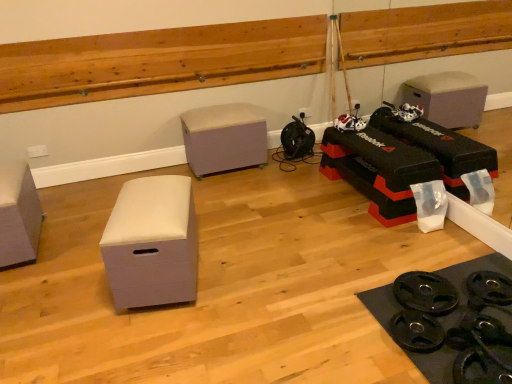
Image resolution: width=512 pixels, height=384 pixels. Describe the element at coordinates (224, 138) in the screenshot. I see `beige fabric ottoman at center, acting as the third furniture starting from the left` at that location.

Image resolution: width=512 pixels, height=384 pixels. What do you see at coordinates (152, 243) in the screenshot? I see `white matte storage box at center-left, which is counted as the 2th furniture, starting from the right` at bounding box center [152, 243].

At what (x,y) coordinates should I click in order to perform the action: click on beige fabric ottoman at center, the first furniture in the back-to-front sequence. Please return your answer as a coordinate pair (x, y). This screenshot has height=384, width=512. Looking at the image, I should click on [x=224, y=138].

Is white matte storage box at center-left, the 3th furniture in the back-to-front sequence, looking in the opposite direction of matte gray storage box at left, which is counted as the 2th furniture, starting from the back?

No, white matte storage box at center-left, the 3th furniture in the back-to-front sequence, is not facing the opposite direction of matte gray storage box at left, which is counted as the 2th furniture, starting from the back.

Looking at this image, is the surface of white matte storage box at center-left, placed as the second furniture when sorted from left to right, in direct contact with matte gray storage box at left, placed as the third furniture when sorted from right to left?

white matte storage box at center-left, placed as the second furniture when sorted from left to right, and matte gray storage box at left, placed as the third furniture when sorted from right to left, are clearly separated.

Does point (183, 259) come closer to viewer compared to point (28, 204)?

Yes.

Considering the positions of objects white matte storage box at center-left, placed as the second furniture when sorted from left to right, and matte gray storage box at left, which is counted as the 2th furniture, starting from the back, in the image provided, who is behind, white matte storage box at center-left, placed as the second furniture when sorted from left to right, or matte gray storage box at left, which is counted as the 2th furniture, starting from the back,?

matte gray storage box at left, which is counted as the 2th furniture, starting from the back, is behind.

Is beige fabric ottoman at center, acting as the third furniture starting from the left, directly adjacent to wooden ledge at upper center?

No.

Does beige fabric ottoman at center, the 3th furniture positioned from the front, appear on the right side of wooden ledge at upper center?

Correct, you'll find beige fabric ottoman at center, the 3th furniture positioned from the front, to the right of wooden ledge at upper center.

Is wooden ledge at upper center inside beige fabric ottoman at center, the first furniture in the back-to-front sequence?

No, wooden ledge at upper center is not inside beige fabric ottoman at center, the first furniture in the back-to-front sequence.

From the image's perspective, is wooden ledge at upper center under white matte storage box at center-left, which is counted as the 2th furniture, starting from the right?

No, from the image's perspective, wooden ledge at upper center is not beneath white matte storage box at center-left, which is counted as the 2th furniture, starting from the right.

Which object is closer to the camera taking this photo, wooden ledge at upper center or white matte storage box at center-left, placed as the second furniture when sorted from left to right?

white matte storage box at center-left, placed as the second furniture when sorted from left to right, is more forward.

Is wooden ledge at upper center aimed at white matte storage box at center-left, placed as the second furniture when sorted from left to right?

No, wooden ledge at upper center is not aimed at white matte storage box at center-left, placed as the second furniture when sorted from left to right.

How many degrees apart are the facing directions of wooden ledge at upper center and white matte storage box at center-left, which is counted as the 2th furniture, starting from the right?

The facing directions of wooden ledge at upper center and white matte storage box at center-left, which is counted as the 2th furniture, starting from the right, are 103 degrees apart.

Is wooden ledge at upper center oriented towards beige fabric ottoman at center, the 3th furniture positioned from the front?

No, wooden ledge at upper center is not facing towards beige fabric ottoman at center, the 3th furniture positioned from the front.

Looking at this image, is wooden ledge at upper center beside beige fabric ottoman at center, which is counted as the 1th furniture, starting from the right?

wooden ledge at upper center and beige fabric ottoman at center, which is counted as the 1th furniture, starting from the right, are clearly separated.

Does wooden ledge at upper center have a lesser height compared to beige fabric ottoman at center, which is counted as the 1th furniture, starting from the right?

Indeed, wooden ledge at upper center has a lesser height compared to beige fabric ottoman at center, which is counted as the 1th furniture, starting from the right.

Looking at this image, can you confirm if wooden ledge at upper center is positioned to the right of beige fabric ottoman at center, the first furniture in the back-to-front sequence?

In fact, wooden ledge at upper center is to the left of beige fabric ottoman at center, the first furniture in the back-to-front sequence.

Which is less distant, (x=21, y=179) or (x=241, y=161)?

Positioned in front is point (x=21, y=179).

Is matte gray storage box at left, placed as the third furniture when sorted from right to left, oriented away from beige fabric ottoman at center, which is counted as the 1th furniture, starting from the right?

No.

Is matte gray storage box at left, which is counted as the 2th furniture, starting from the back, placed right next to beige fabric ottoman at center, acting as the third furniture starting from the left?

No, matte gray storage box at left, which is counted as the 2th furniture, starting from the back, is not with beige fabric ottoman at center, acting as the third furniture starting from the left.

Where is `the 2nd furniture counting from the left of the beige fabric ottoman at center, the 3th furniture positioned from the front`? Image resolution: width=512 pixels, height=384 pixels. the 2nd furniture counting from the left of the beige fabric ottoman at center, the 3th furniture positioned from the front is located at coordinates (18, 214).

Is wooden ledge at upper center surrounding matte gray storage box at left, placed as the third furniture when sorted from right to left?

No, wooden ledge at upper center does not contain matte gray storage box at left, placed as the third furniture when sorted from right to left.

How different are the orientations of wooden ledge at upper center and matte gray storage box at left, placed as the first furniture when sorted from left to right, in degrees?

They differ by 1.63 degrees in their facing directions.

Does point (224, 37) lie in front of point (8, 264)?

No, it is behind (8, 264).

From the image's perspective, is wooden ledge at upper center located above matte gray storage box at left, the second furniture when ordered from front to back?

Yes.

Is beige fabric ottoman at center, the first furniture in the back-to-front sequence, in front of or behind white matte storage box at center-left, which is the 1th furniture from front to back, in the image?

Visually, beige fabric ottoman at center, the first furniture in the back-to-front sequence, is located behind white matte storage box at center-left, which is the 1th furniture from front to back.

Is beige fabric ottoman at center, the first furniture in the back-to-front sequence, oriented away from white matte storage box at center-left, which is counted as the 2th furniture, starting from the right?

That's not correct — beige fabric ottoman at center, the first furniture in the back-to-front sequence, is not looking away from white matte storage box at center-left, which is counted as the 2th furniture, starting from the right.

Can you tell me how much beige fabric ottoman at center, the 3th furniture positioned from the front, and white matte storage box at center-left, the 3th furniture in the back-to-front sequence, differ in facing direction?

beige fabric ottoman at center, the 3th furniture positioned from the front, and white matte storage box at center-left, the 3th furniture in the back-to-front sequence, are facing 104 degrees away from each other.

From a real-world perspective, starting from the white matte storage box at center-left, the 3th furniture in the back-to-front sequence, which furniture is the 2nd one vertically above it? Please provide its 2D coordinates.

[(224, 138)]

I want to click on the 1st furniture behind the white matte storage box at center-left, which is counted as the 2th furniture, starting from the right, so click(x=18, y=214).

In order to click on ledge lying on the left of beige fabric ottoman at center, the first furniture in the back-to-front sequence in this screenshot , I will do `click(157, 61)`.

Considering their positions, is beige fabric ottoman at center, acting as the third furniture starting from the left, positioned closer to white matte storage box at center-left, which is the 1th furniture from front to back, than wooden ledge at upper center?

beige fabric ottoman at center, acting as the third furniture starting from the left.

Looking at this image, considering their positions, is wooden ledge at upper center positioned closer to white matte storage box at center-left, the 3th furniture in the back-to-front sequence, than matte gray storage box at left, the second furniture when ordered from front to back?

Among the two, matte gray storage box at left, the second furniture when ordered from front to back, is located nearer to white matte storage box at center-left, the 3th furniture in the back-to-front sequence.

When comparing their distances from beige fabric ottoman at center, the first furniture in the back-to-front sequence, does wooden ledge at upper center or matte gray storage box at left, placed as the third furniture when sorted from right to left, seem closer?

Among the two, wooden ledge at upper center is located nearer to beige fabric ottoman at center, the first furniture in the back-to-front sequence.

Considering their positions, is matte gray storage box at left, placed as the third furniture when sorted from right to left, positioned closer to white matte storage box at center-left, placed as the second furniture when sorted from left to right, than beige fabric ottoman at center, the first furniture in the back-to-front sequence?

Among the two, matte gray storage box at left, placed as the third furniture when sorted from right to left, is located nearer to white matte storage box at center-left, placed as the second furniture when sorted from left to right.

Looking at the image, which one is located closer to wooden ledge at upper center, white matte storage box at center-left, placed as the second furniture when sorted from left to right, or matte gray storage box at left, placed as the third furniture when sorted from right to left?

matte gray storage box at left, placed as the third furniture when sorted from right to left, is closer to wooden ledge at upper center.

Looking at the image, which one is located further to wooden ledge at upper center, white matte storage box at center-left, which is counted as the 2th furniture, starting from the right, or beige fabric ottoman at center, the first furniture in the back-to-front sequence?

Based on the image, white matte storage box at center-left, which is counted as the 2th furniture, starting from the right, appears to be further to wooden ledge at upper center.

Estimate the real-world distances between objects in this image. Which object is closer to wooden ledge at upper center, matte gray storage box at left, the second furniture when ordered from front to back, or beige fabric ottoman at center, the first furniture in the back-to-front sequence?

beige fabric ottoman at center, the first furniture in the back-to-front sequence.

When comparing their distances from beige fabric ottoman at center, the 3th furniture positioned from the front, does matte gray storage box at left, placed as the first furniture when sorted from left to right, or wooden ledge at upper center seem further?

Based on the image, matte gray storage box at left, placed as the first furniture when sorted from left to right, appears to be further to beige fabric ottoman at center, the 3th furniture positioned from the front.

I want to click on ledge between matte gray storage box at left, placed as the third furniture when sorted from right to left, and beige fabric ottoman at center, which is counted as the 1th furniture, starting from the right, in the horizontal direction, so click(x=157, y=61).

The width and height of the screenshot is (512, 384). What are the coordinates of `ledge located between white matte storage box at center-left, placed as the second furniture when sorted from left to right, and beige fabric ottoman at center, acting as the third furniture starting from the left, in the depth direction` in the screenshot? It's located at (157, 61).

Where is `furniture between white matte storage box at center-left, placed as the second furniture when sorted from left to right, and beige fabric ottoman at center, acting as the third furniture starting from the left, from front to back`? Image resolution: width=512 pixels, height=384 pixels. furniture between white matte storage box at center-left, placed as the second furniture when sorted from left to right, and beige fabric ottoman at center, acting as the third furniture starting from the left, from front to back is located at coordinates coord(18,214).